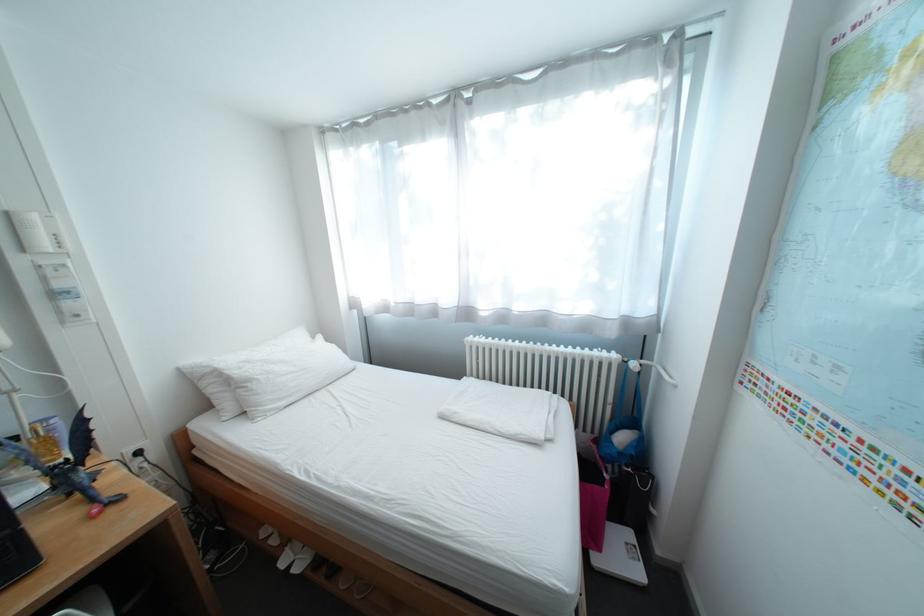
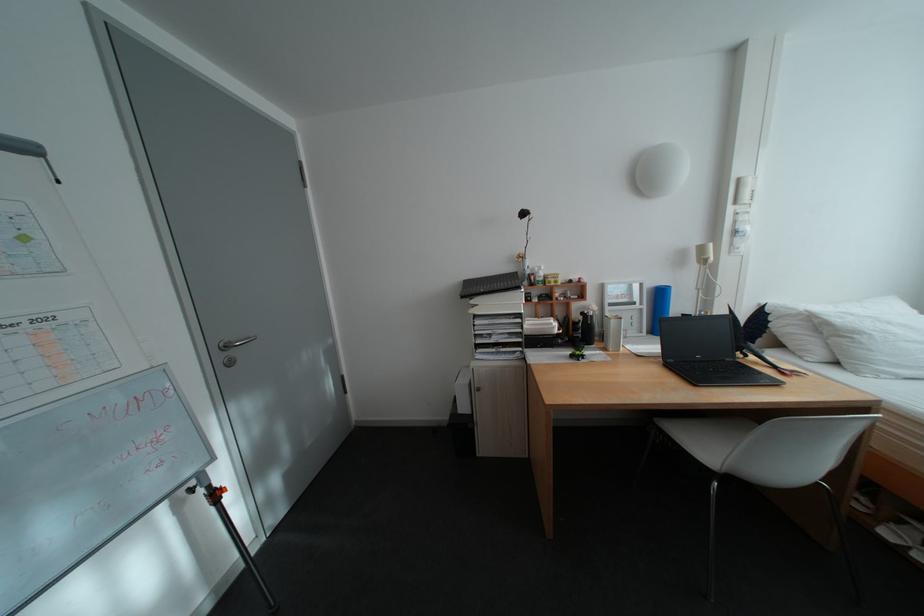
The point at (x=263, y=383) is marked in the first image. Where is the corresponding point in the second image?

(871, 334)